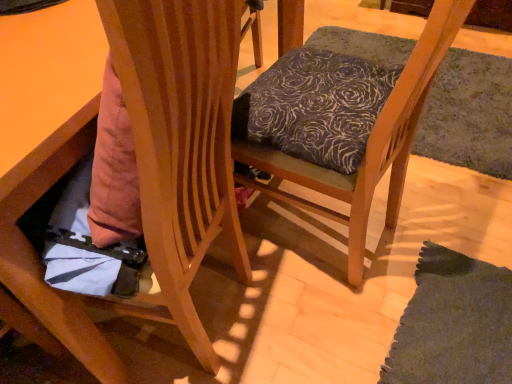
Question: Is wooden chair at lower left, which is counted as the second chair, starting from the right, oriented away from textured fabric cushion at center, positioned as the 2th chair in left-to-right order?

Choices:
 (A) yes
 (B) no

Answer: (B)

Question: Is wooden chair at lower left, positioned as the 1th chair in left-to-right order, at the right side of textured fabric cushion at center, positioned as the 2th chair in left-to-right order?

Choices:
 (A) no
 (B) yes

Answer: (A)

Question: From a real-world perspective, does wooden chair at lower left, positioned as the 1th chair in left-to-right order, stand above textured fabric cushion at center, positioned as the 2th chair in left-to-right order?

Choices:
 (A) no
 (B) yes

Answer: (A)

Question: Considering the relative positions of wooden chair at lower left, which is counted as the second chair, starting from the right, and textured fabric cushion at center, positioned as the 2th chair in left-to-right order, in the image provided, is wooden chair at lower left, which is counted as the second chair, starting from the right, to the left of textured fabric cushion at center, positioned as the 2th chair in left-to-right order, from the viewer's perspective?

Choices:
 (A) yes
 (B) no

Answer: (A)

Question: Is the position of wooden chair at lower left, which is counted as the second chair, starting from the right, more distant than that of textured fabric cushion at center, the first chair when ordered from right to left?

Choices:
 (A) no
 (B) yes

Answer: (A)

Question: From a real-world perspective, is wooden chair at lower left, which is counted as the second chair, starting from the right, physically below textured fabric cushion at center, positioned as the 2th chair in left-to-right order?

Choices:
 (A) no
 (B) yes

Answer: (B)

Question: Is textured fabric cushion at center, the first chair when ordered from right to left, bigger than wooden chair at lower left, which is counted as the second chair, starting from the right?

Choices:
 (A) no
 (B) yes

Answer: (A)

Question: Is textured fabric cushion at center, the first chair when ordered from right to left, closer to the viewer compared to wooden chair at lower left, which is counted as the second chair, starting from the right?

Choices:
 (A) no
 (B) yes

Answer: (A)

Question: Is textured fabric cushion at center, the first chair when ordered from right to left, far away from wooden chair at lower left, positioned as the 1th chair in left-to-right order?

Choices:
 (A) yes
 (B) no

Answer: (B)

Question: Can you confirm if textured fabric cushion at center, positioned as the 2th chair in left-to-right order, is positioned to the right of wooden chair at lower left, positioned as the 1th chair in left-to-right order?

Choices:
 (A) yes
 (B) no

Answer: (A)

Question: Can you confirm if textured fabric cushion at center, the first chair when ordered from right to left, is wider than wooden chair at lower left, positioned as the 1th chair in left-to-right order?

Choices:
 (A) no
 (B) yes

Answer: (A)

Question: Is textured fabric cushion at center, positioned as the 2th chair in left-to-right order, looking in the opposite direction of wooden chair at lower left, which is counted as the second chair, starting from the right?

Choices:
 (A) no
 (B) yes

Answer: (A)

Question: From the image's perspective, is textured fabric cushion at center, the first chair when ordered from right to left, above or below wooden chair at lower left, positioned as the 1th chair in left-to-right order?

Choices:
 (A) below
 (B) above

Answer: (B)